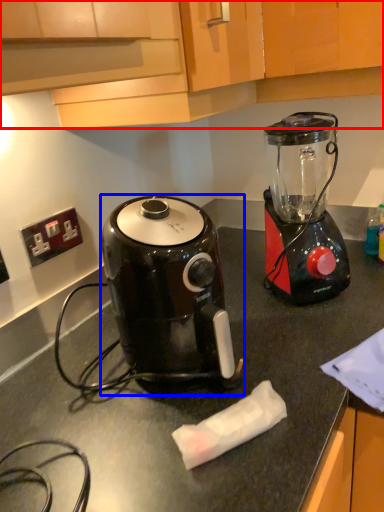
Question: Which of the following is the farthest to the observer, cabinetry (highlighted by a red box) or coffee maker (highlighted by a blue box)?

Choices:
 (A) cabinetry
 (B) coffee maker

Answer: (B)